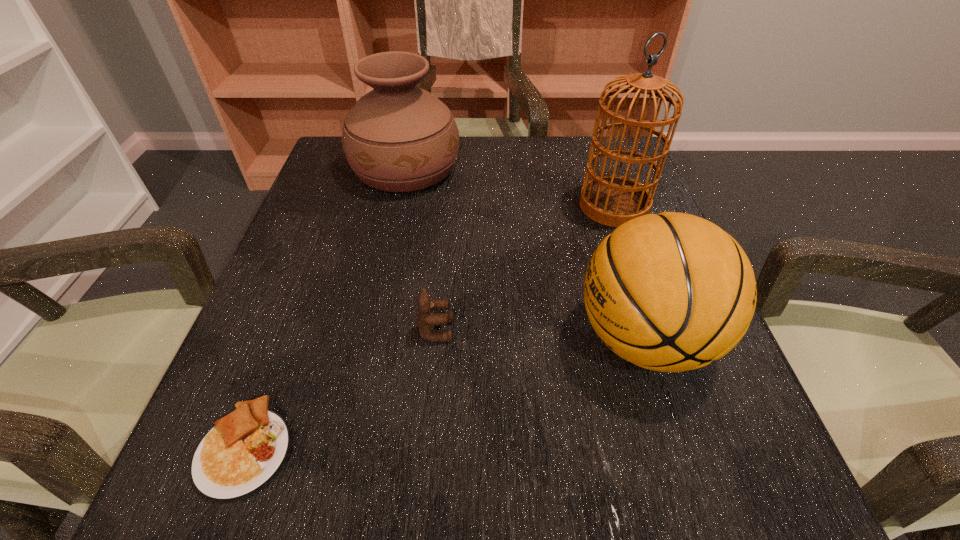
You are a GUI agent. You are given a task and a screenshot of the screen. Output one action in this format:
    pyautogui.click(x=<x>, y=<y>)
    Task: Click on the tallest object
    This screenshot has height=540, width=960.
    Given the screenshot: What is the action you would take?
    pyautogui.click(x=612, y=200)

Find the location of a particular element. urn is located at coordinates (398, 137).

The height and width of the screenshot is (540, 960). I want to click on basketball, so click(671, 292).

Find the location of a particular element. Image resolution: width=960 pixels, height=540 pixels. teddy bear is located at coordinates (426, 320).

Locate an element on the screen. The height and width of the screenshot is (540, 960). omelet is located at coordinates (238, 457).

The height and width of the screenshot is (540, 960). Identify the location of vacant space located on the left of the tallest object. (535, 206).

The width and height of the screenshot is (960, 540). Identify the location of vacant area situated on the right of the urn. (563, 168).

Locate an element on the screen. The width and height of the screenshot is (960, 540). vacant space located on the surface of the basketball near the brand logo is located at coordinates (501, 339).

The width and height of the screenshot is (960, 540). Find the location of `vacant space situated on the surface of the basketball near the brand logo`. vacant space situated on the surface of the basketball near the brand logo is located at coordinates (538, 339).

Locate an element on the screen. Image resolution: width=960 pixels, height=540 pixels. vacant point located on the surface of the basketball near the brand logo is located at coordinates (398, 339).